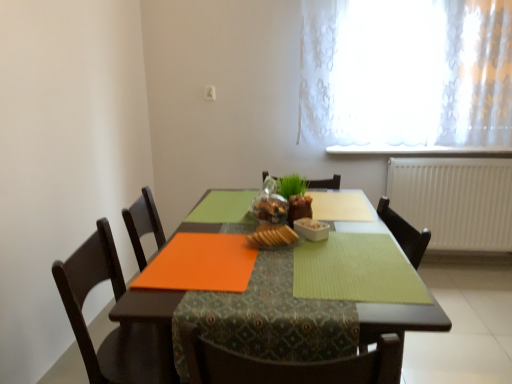
Question: Are orange matte placemat at center and white glossy bowl at center making contact?

Choices:
 (A) yes
 (B) no

Answer: (B)

Question: From a real-world perspective, is orange matte placemat at center on white glossy bowl at center?

Choices:
 (A) yes
 (B) no

Answer: (B)

Question: From the image's perspective, is orange matte placemat at center over white glossy bowl at center?

Choices:
 (A) yes
 (B) no

Answer: (B)

Question: From a real-world perspective, does orange matte placemat at center sit lower than white glossy bowl at center?

Choices:
 (A) no
 (B) yes

Answer: (B)

Question: From the image's perspective, does orange matte placemat at center appear lower than white glossy bowl at center?

Choices:
 (A) no
 (B) yes

Answer: (B)

Question: Is orange matte placemat at center aimed at white glossy bowl at center?

Choices:
 (A) no
 (B) yes

Answer: (A)

Question: Is white glossy bowl at center to the left of slightly toasted bread at center from the viewer's perspective?

Choices:
 (A) yes
 (B) no

Answer: (B)

Question: From the image's perspective, would you say white glossy bowl at center is positioned over slightly toasted bread at center?

Choices:
 (A) no
 (B) yes

Answer: (B)

Question: Does white glossy bowl at center have a larger size compared to slightly toasted bread at center?

Choices:
 (A) yes
 (B) no

Answer: (B)

Question: Is white glossy bowl at center taller than slightly toasted bread at center?

Choices:
 (A) yes
 (B) no

Answer: (B)

Question: Can you confirm if white glossy bowl at center is smaller than slightly toasted bread at center?

Choices:
 (A) yes
 (B) no

Answer: (A)

Question: From a real-world perspective, is white glossy bowl at center on slightly toasted bread at center?

Choices:
 (A) no
 (B) yes

Answer: (A)

Question: Is slightly toasted bread at center far away from white plastic radiator at right?

Choices:
 (A) yes
 (B) no

Answer: (A)